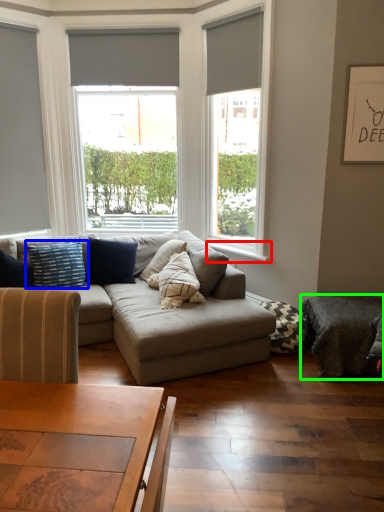
Question: Which is nearer to the window sill (highlighted by a red box)? pillow (highlighted by a blue box) or footrest (highlighted by a green box).

Choices:
 (A) pillow
 (B) footrest

Answer: (B)